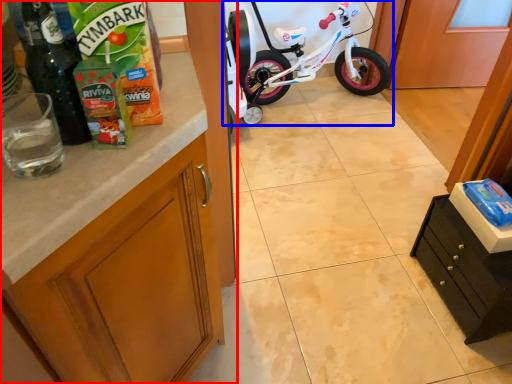
Question: Which object is closer to the camera taking this photo, cabinetry (highlighted by a red box) or bicycle (highlighted by a blue box)?

Choices:
 (A) cabinetry
 (B) bicycle

Answer: (A)